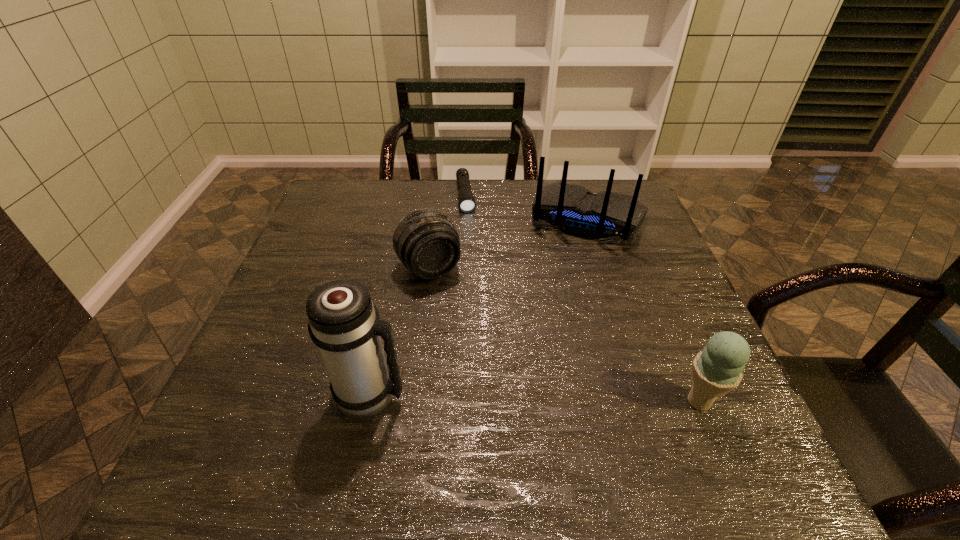
You are a GUI agent. You are given a task and a screenshot of the screen. Output one action in this format:
    pyautogui.click(x=<x>, y=<y>)
    Task: Click on the vacant space situated 0.310m on the back of the router
    The image size is (960, 540).
    Given the screenshot: What is the action you would take?
    (x=542, y=332)

Where is `vacant space located 0.220m on the back of the router`? The height and width of the screenshot is (540, 960). vacant space located 0.220m on the back of the router is located at coordinates (553, 304).

Where is `vacant space located 0.260m on the back of the router`? This screenshot has height=540, width=960. vacant space located 0.260m on the back of the router is located at coordinates (548, 316).

The width and height of the screenshot is (960, 540). What are the coordinates of `free spot located 0.360m at the lens end of the shortest object` in the screenshot? It's located at (480, 301).

This screenshot has width=960, height=540. Identify the location of free space located at the lens end of the shortest object. (475, 273).

Where is `free space located at the lens end of the shortest object`? free space located at the lens end of the shortest object is located at coordinates (480, 301).

This screenshot has height=540, width=960. What are the coordinates of `router present at the far edge` in the screenshot? It's located at (572, 209).

Where is `flashlight that is positioned at the far edge`? The height and width of the screenshot is (540, 960). flashlight that is positioned at the far edge is located at coordinates (x=466, y=199).

The image size is (960, 540). I want to click on thermos bottle that is at the near edge, so click(x=343, y=322).

Where is `ice cream that is at the near edge`? Image resolution: width=960 pixels, height=540 pixels. ice cream that is at the near edge is located at coordinates (716, 370).